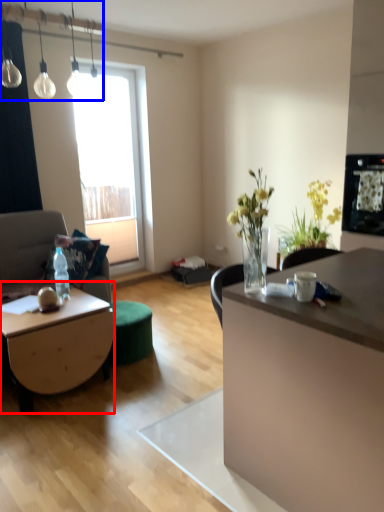
Question: Among these objects, which one is nearest to the camera, coffee table (highlighted by a red box) or lamp (highlighted by a blue box)?

Choices:
 (A) coffee table
 (B) lamp

Answer: (B)